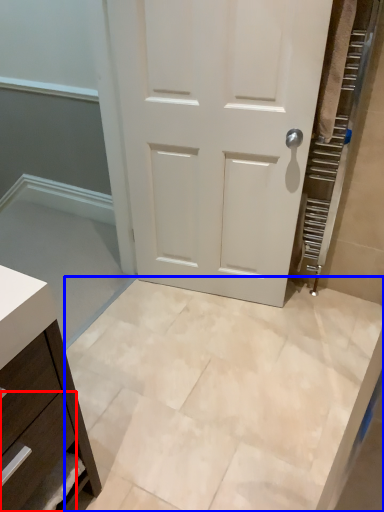
Question: Which of the following is the closest to the observer, drawer (highlighted by a red box) or ceramic tile (highlighted by a blue box)?

Choices:
 (A) drawer
 (B) ceramic tile

Answer: (A)